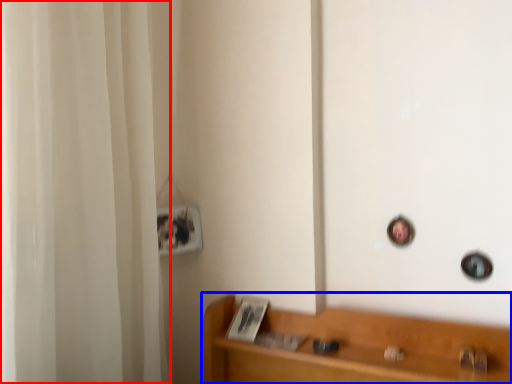
Question: Which point is further to the camera, shower curtain (highlighted by a red box) or furniture (highlighted by a blue box)?

Choices:
 (A) shower curtain
 (B) furniture

Answer: (B)